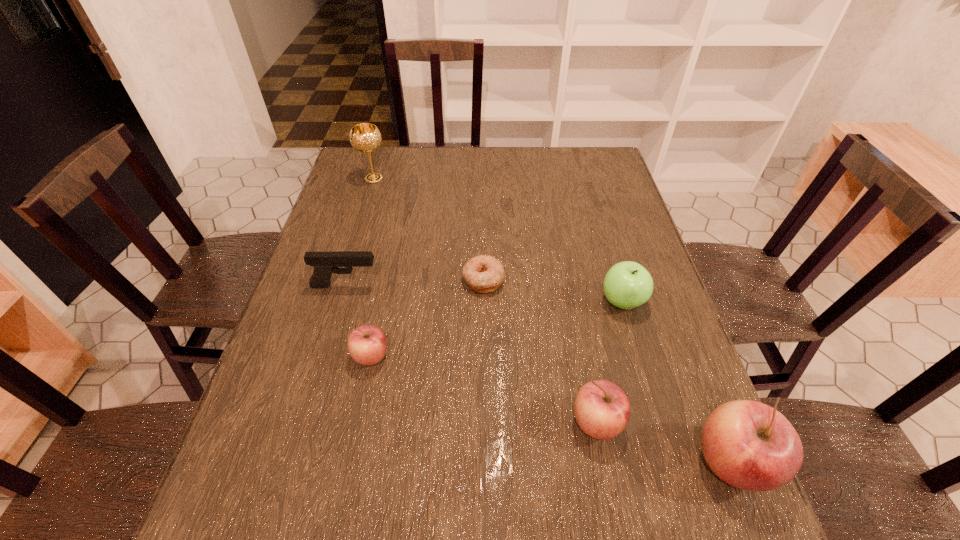
If equal spacing is the goal by inserting an additional apple among them, please point out a vacant space for this new apple. Please provide its 2D coordinates. Your answer should be formatted as a tuple, i.e. [(x, y)], where the tuple contains the x and y coordinates of a point satisfying the conditions above.

[(477, 388)]